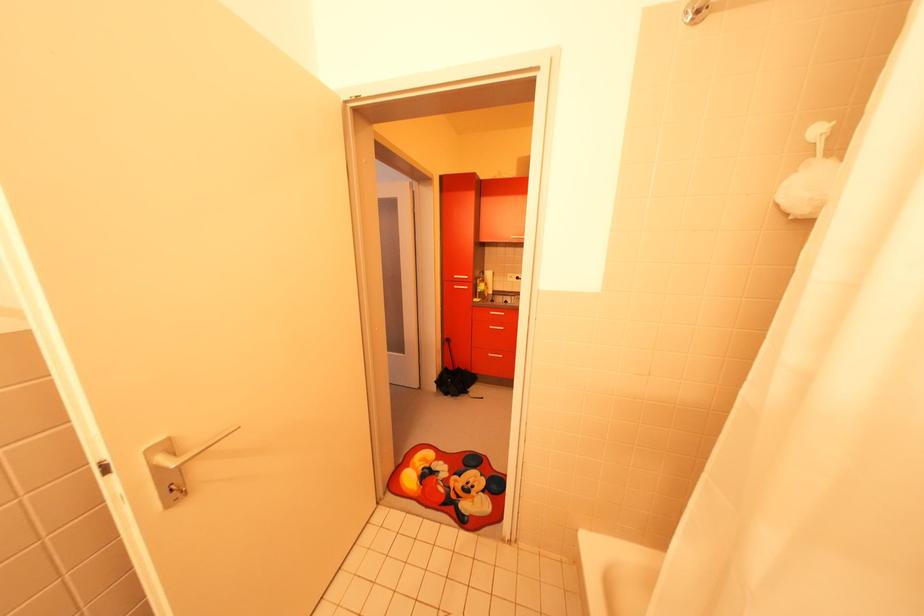
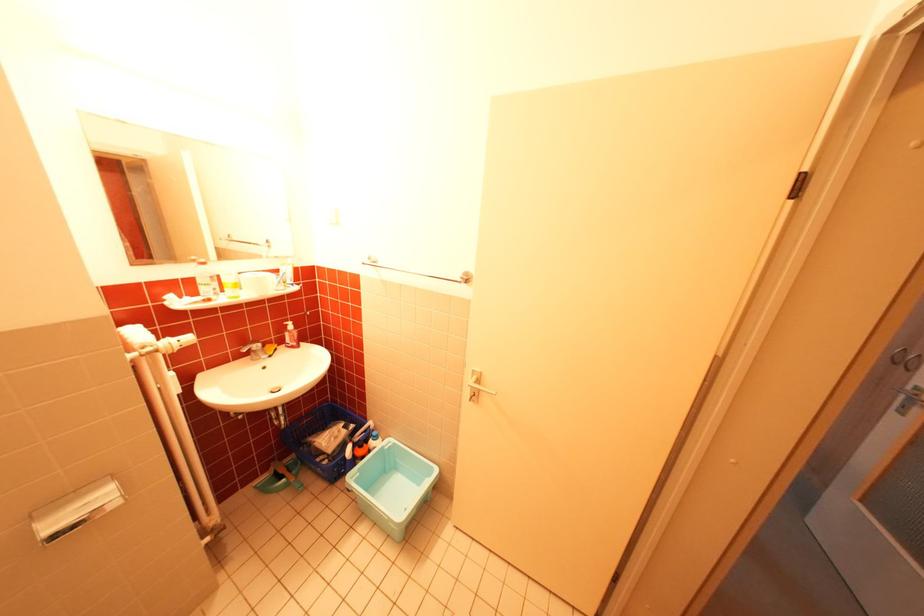
The images are taken continuously from a first-person perspective. In which direction is your viewpoint rotating?

The camera rotated toward left-down.